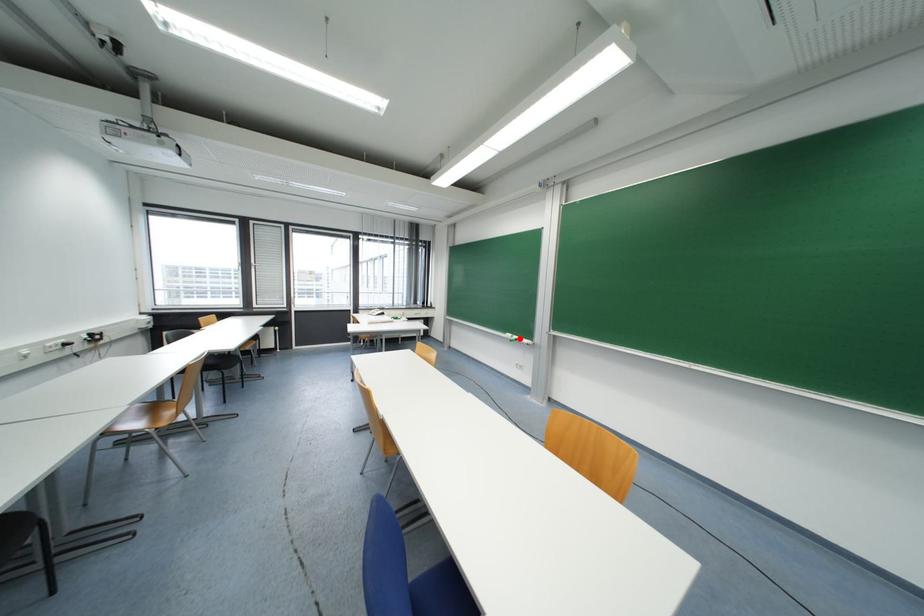
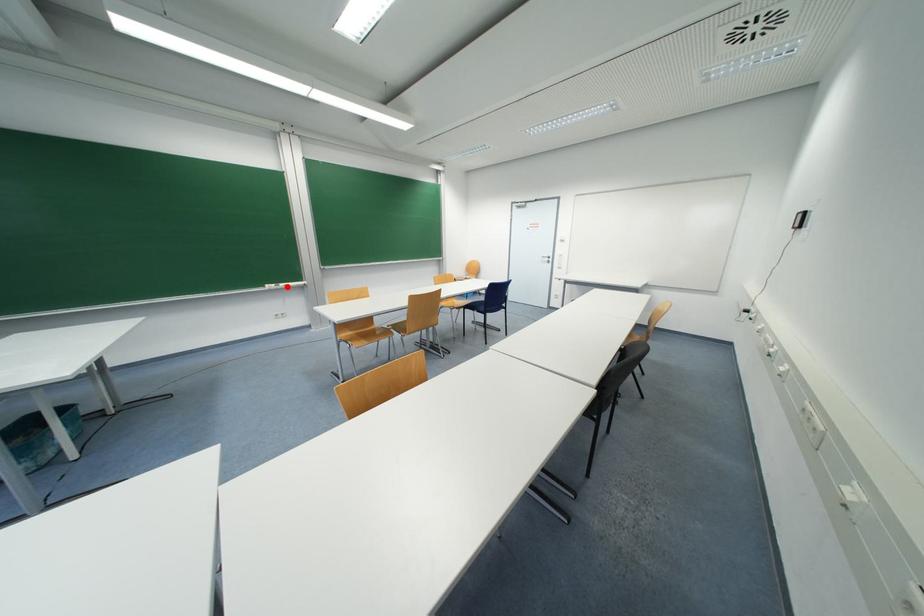
I am providing you with two images of the same scene from different viewpoints. A red point is marked on the first image and another point is marked on the second image. Is the marked point in image1 the same physical position as the marked point in image2?

Yes